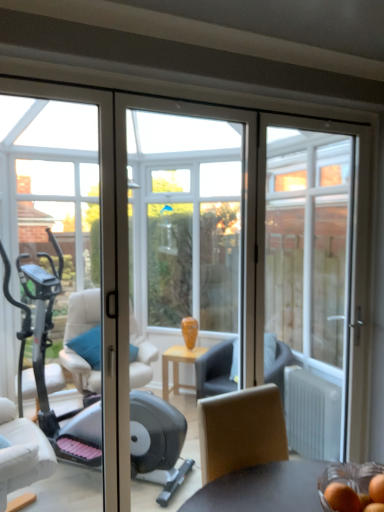
I want to click on transparent glass door at right, so click(317, 254).

Describe the element at coordinates (317, 254) in the screenshot. I see `transparent glass door at right` at that location.

This screenshot has width=384, height=512. What do you see at coordinates (377, 489) in the screenshot? I see `smooth orange fruit at lower right, the second food when ordered from left to right` at bounding box center [377, 489].

Identify the location of orange matte/orange at lower right, the second food when ordered from right to left. This screenshot has height=512, width=384. (343, 498).

This screenshot has width=384, height=512. Find the location of `transparent glass door at right`. transparent glass door at right is located at coordinates (317, 254).

Is smooth orange fruit at lower right, the second food when ordered from left to right, at the left side of orange matte/orange at lower right, the second food when ordered from right to left?

No, smooth orange fruit at lower right, the second food when ordered from left to right, is not to the left of orange matte/orange at lower right, the second food when ordered from right to left.

Are smooth orange fruit at lower right, the second food when ordered from left to right, and orange matte/orange at lower right, the second food when ordered from right to left, far apart?

No, smooth orange fruit at lower right, the second food when ordered from left to right, is not far from orange matte/orange at lower right, the second food when ordered from right to left.

Which is in front, point (382, 499) or point (372, 484)?

The point (382, 499) is in front.

Is smooth orange fruit at lower right, which is the first food in right-to-left order, oriented towards orange matte/orange at lower right, the second food when ordered from right to left?

No, smooth orange fruit at lower right, which is the first food in right-to-left order, does not turn towards orange matte/orange at lower right, the second food when ordered from right to left.

Who is smaller, transparent glass door at right or smooth orange fruit at lower right, which is the first food in right-to-left order?

smooth orange fruit at lower right, which is the first food in right-to-left order.

Is the depth of transparent glass door at right less than that of smooth orange fruit at lower right, which is the first food in right-to-left order?

No, transparent glass door at right is further to the viewer.

Consider the image. Measure the distance from transparent glass door at right to smooth orange fruit at lower right, the second food when ordered from left to right.

transparent glass door at right is 7.69 feet away from smooth orange fruit at lower right, the second food when ordered from left to right.

Is smooth orange fruit at lower right, the second food when ordered from left to right, at the back of transparent glass door at right?

No, smooth orange fruit at lower right, the second food when ordered from left to right, is not at the back of transparent glass door at right.

Between point (349, 498) and point (369, 492), which one is positioned behind?

The point (369, 492) is behind.

Which is more to the right, orange matte/orange at lower right, which appears as the first food when viewed from the left, or smooth orange fruit at lower right, which is the first food in right-to-left order?

Positioned to the right is smooth orange fruit at lower right, which is the first food in right-to-left order.

Is orange matte/orange at lower right, the second food when ordered from right to left, far from smooth orange fruit at lower right, which is the first food in right-to-left order?

No, there isn't a large distance between orange matte/orange at lower right, the second food when ordered from right to left, and smooth orange fruit at lower right, which is the first food in right-to-left order.

Is point (376, 476) farther from viewer compared to point (355, 280)?

No, it is in front of (355, 280).

From a real-world perspective, is smooth orange fruit at lower right, which is the first food in right-to-left order, physically above transparent glass door at right?

No, from a real-world perspective, smooth orange fruit at lower right, which is the first food in right-to-left order, is not on top of transparent glass door at right.

Could you measure the distance between smooth orange fruit at lower right, the second food when ordered from left to right, and transparent glass door at right?

smooth orange fruit at lower right, the second food when ordered from left to right, and transparent glass door at right are 2.34 meters apart.

Is smooth orange fruit at lower right, which is the first food in right-to-left order, completely or partially outside of transparent glass door at right?

Absolutely, smooth orange fruit at lower right, which is the first food in right-to-left order, is external to transparent glass door at right.

Which object is further away from the camera, transparent glass door at right or orange matte/orange at lower right, the second food when ordered from right to left?

transparent glass door at right.

Is transparent glass door at right in contact with orange matte/orange at lower right, which appears as the first food when viewed from the left?

No, transparent glass door at right is not making contact with orange matte/orange at lower right, which appears as the first food when viewed from the left.

Considering the sizes of objects transparent glass door at right and orange matte/orange at lower right, which appears as the first food when viewed from the left, in the image provided, who is thinner, transparent glass door at right or orange matte/orange at lower right, which appears as the first food when viewed from the left,?

Thinner between the two is orange matte/orange at lower right, which appears as the first food when viewed from the left.

What's the angular difference between transparent glass door at right and orange matte/orange at lower right, which appears as the first food when viewed from the left,'s facing directions?

164 degrees.

This screenshot has width=384, height=512. Identify the location of door above the orange matte/orange at lower right, the second food when ordered from right to left (from the image's perspective). (317, 254).

From the image's perspective, does orange matte/orange at lower right, the second food when ordered from right to left, appear higher than transparent glass door at right?

No, from the image's perspective, orange matte/orange at lower right, the second food when ordered from right to left, is not over transparent glass door at right.

Is orange matte/orange at lower right, the second food when ordered from right to left, next to transparent glass door at right?

orange matte/orange at lower right, the second food when ordered from right to left, and transparent glass door at right are clearly separated.

Looking at their sizes, would you say orange matte/orange at lower right, the second food when ordered from right to left, is wider or thinner than transparent glass door at right?

Considering their sizes, orange matte/orange at lower right, the second food when ordered from right to left, looks slimmer than transparent glass door at right.

Find the location of a particular element. This screenshot has width=384, height=512. food on the left of smooth orange fruit at lower right, the second food when ordered from left to right is located at coordinates (343, 498).

I want to click on door on the right of smooth orange fruit at lower right, which is the first food in right-to-left order, so click(x=317, y=254).

Estimate the real-world distances between objects in this image. Which object is closer to transparent glass door at right, smooth orange fruit at lower right, which is the first food in right-to-left order, or orange matte/orange at lower right, which appears as the first food when viewed from the left?

orange matte/orange at lower right, which appears as the first food when viewed from the left, is positioned closer to the anchor transparent glass door at right.

Estimate the real-world distances between objects in this image. Which object is closer to orange matte/orange at lower right, which appears as the first food when viewed from the left, smooth orange fruit at lower right, the second food when ordered from left to right, or transparent glass door at right?

Among the two, smooth orange fruit at lower right, the second food when ordered from left to right, is located nearer to orange matte/orange at lower right, which appears as the first food when viewed from the left.

Consider the image. From the image, which object appears to be nearer to smooth orange fruit at lower right, which is the first food in right-to-left order, orange matte/orange at lower right, the second food when ordered from right to left, or transparent glass door at right?

orange matte/orange at lower right, the second food when ordered from right to left, is positioned closer to the anchor smooth orange fruit at lower right, which is the first food in right-to-left order.

Which object lies nearer to the anchor point orange matte/orange at lower right, which appears as the first food when viewed from the left, transparent glass door at right or smooth orange fruit at lower right, which is the first food in right-to-left order?

Based on the image, smooth orange fruit at lower right, which is the first food in right-to-left order, appears to be nearer to orange matte/orange at lower right, which appears as the first food when viewed from the left.

Looking at this image, based on their spatial positions, is transparent glass door at right or orange matte/orange at lower right, the second food when ordered from right to left, closer to smooth orange fruit at lower right, which is the first food in right-to-left order?

Among the two, orange matte/orange at lower right, the second food when ordered from right to left, is located nearer to smooth orange fruit at lower right, which is the first food in right-to-left order.

From the image, which object appears to be farther from transparent glass door at right, orange matte/orange at lower right, the second food when ordered from right to left, or smooth orange fruit at lower right, the second food when ordered from left to right?

The object further to transparent glass door at right is smooth orange fruit at lower right, the second food when ordered from left to right.

Locate an element on the screen. food positioned between orange matte/orange at lower right, which appears as the first food when viewed from the left, and transparent glass door at right from near to far is located at coordinates (377, 489).